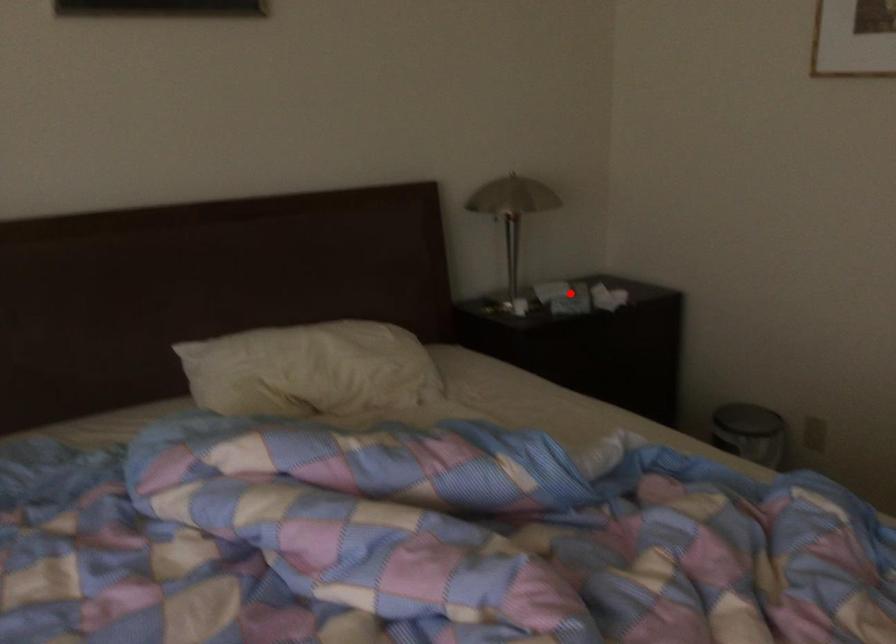
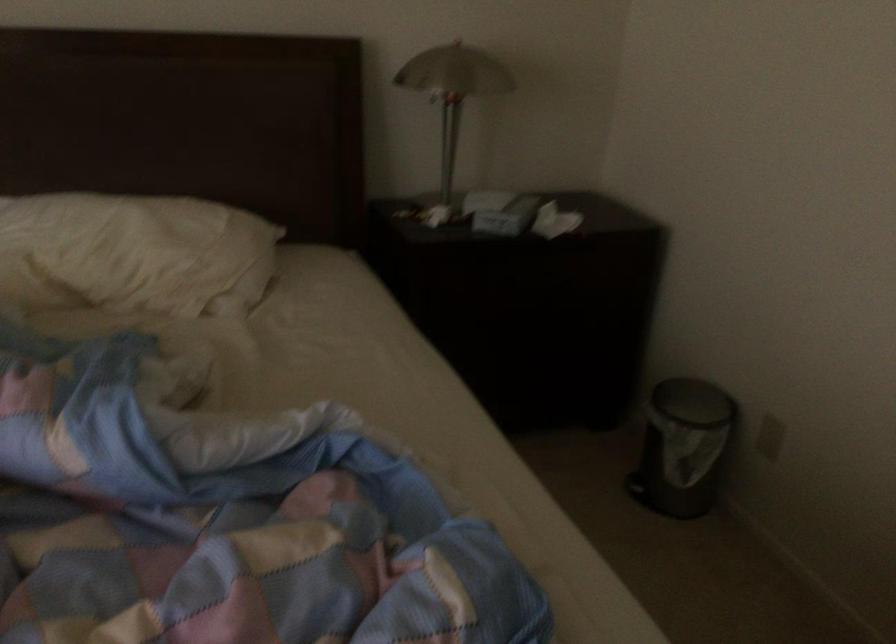
In the second image, find the point that corresponds to the highlighted location in the first image.

(501, 212)